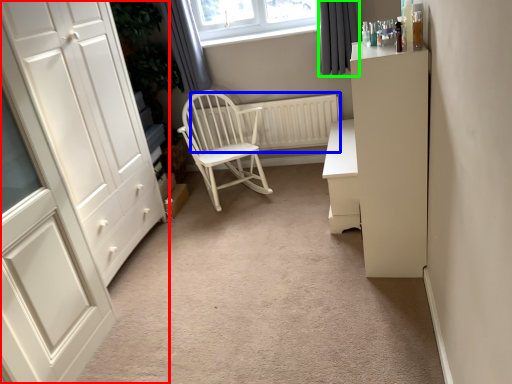
Question: Based on their relative distances, which object is nearer to cupboard (highlighted by a red box)? Choose from radiator (highlighted by a blue box) and curtain (highlighted by a green box).

Choices:
 (A) radiator
 (B) curtain

Answer: (A)